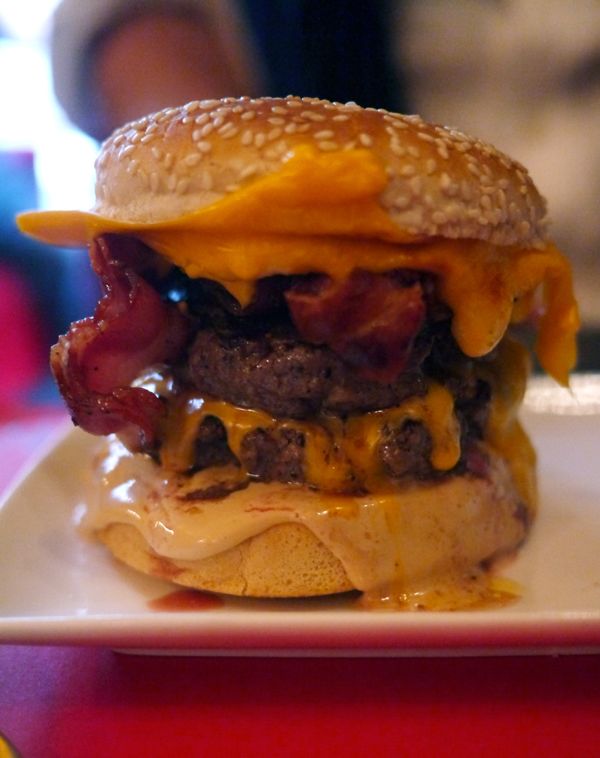
Identify the location of plate. The image size is (600, 758). (562, 537).